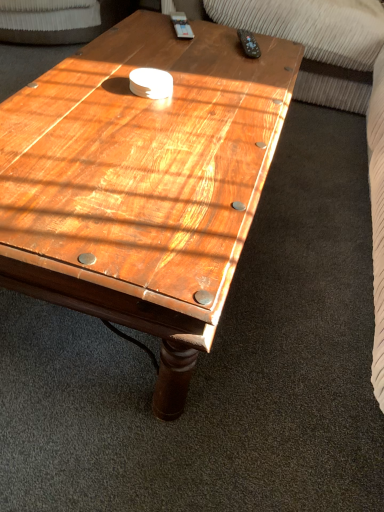
You are a GUI agent. You are given a task and a screenshot of the screen. Output one action in this format:
    pyautogui.click(x=<x>, y=<y>)
    Task: Click on the blank space situated above wooden coffee table at center (from a real-world perspective)
    This screenshot has height=512, width=384.
    Given the screenshot: What is the action you would take?
    pyautogui.click(x=162, y=98)